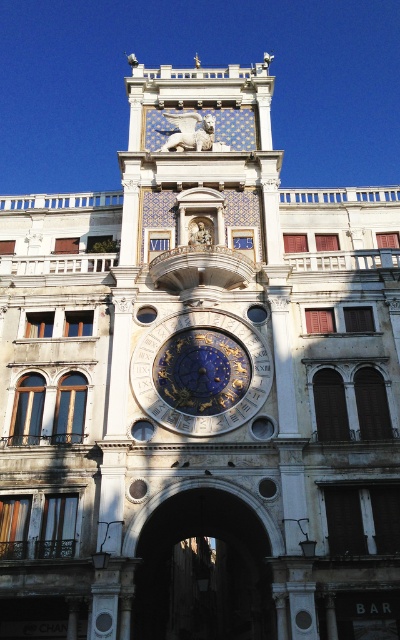
Is point (208, 579) closer to camera compared to point (249, 394)?

No, (208, 579) is further to viewer.

Measure the distance between point (218, 529) and camera.

Point (218, 529) and camera are 47.44 meters apart from each other.

Which is behind, point (188, 605) or point (179, 339)?

The point (188, 605) is more distant.

Locate an element on the screen. dark stone archway at center is located at coordinates (202, 572).